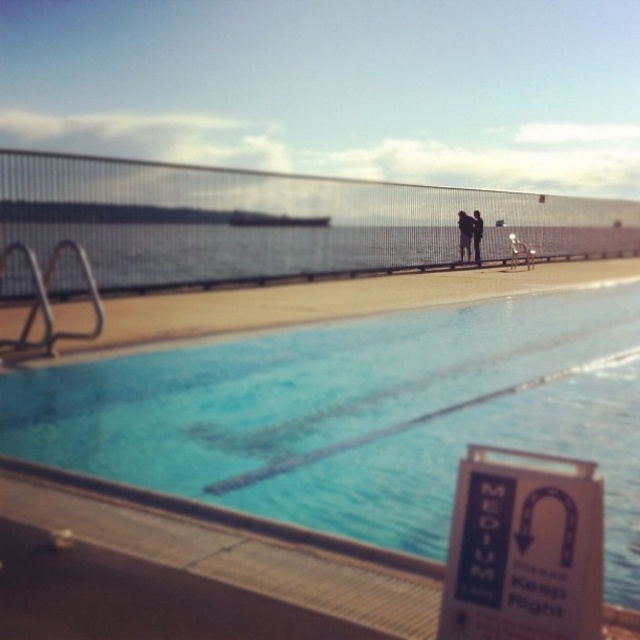
You are standing on the pool deck and notice the blue smooth water at center and the dark blue fabric couple at center. Which object is closer to you?

The blue smooth water at center is closer to you because it is in front of the dark blue fabric couple at center.

You are a lifeguard standing on the pool deck and see the blue smooth water at center and the black fabric person at center. Which one is taller?

The black fabric person at center is taller than the blue smooth water at center.

You are a lifeguard on duty and need to monitor both the blue smooth water at center and the black fabric person at center. Which of these two is visually more prominent in the scene?

The blue smooth water at center is visually more prominent because it is larger in size than the black fabric person at center.